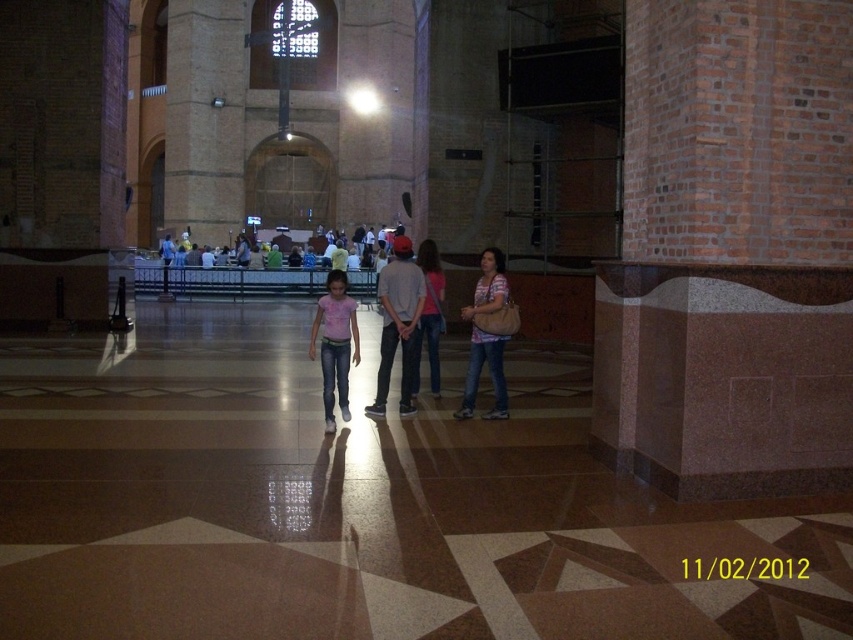
Which is above, gray cotton shirt at center or matte brown purse at center?

gray cotton shirt at center is above.

Which is more to the right, gray cotton shirt at center or matte brown purse at center?

matte brown purse at center

Does point (396, 324) come farther from viewer compared to point (469, 317)?

Yes, it is behind point (469, 317).

At what (x,y) coordinates should I click in order to perform the action: click on gray cotton shirt at center. Please return your answer as a coordinate pair (x, y). The width and height of the screenshot is (853, 640). Looking at the image, I should click on (397, 323).

Can you confirm if matte brown purse at center is shorter than pink denim jeans at center?

Incorrect, matte brown purse at center's height does not fall short of pink denim jeans at center's.

Which is more to the right, matte brown purse at center or pink denim jeans at center?

matte brown purse at center

Which is behind, point (498, 390) or point (343, 285)?

The point (498, 390) is behind.

You are a GUI agent. You are given a task and a screenshot of the screen. Output one action in this format:
    pyautogui.click(x=<x>, y=<y>)
    Task: Click on the matte brown purse at center
    This screenshot has width=853, height=640.
    Given the screenshot: What is the action you would take?
    pyautogui.click(x=480, y=371)

Is point (418, 284) farther from viewer compared to point (418, 262)?

No, (418, 284) is in front of (418, 262).

Who is taller, gray cotton shirt at center or denim jeans at center?

gray cotton shirt at center is taller.

The image size is (853, 640). What do you see at coordinates (397, 323) in the screenshot?
I see `gray cotton shirt at center` at bounding box center [397, 323].

The image size is (853, 640). Find the location of `gray cotton shirt at center`. gray cotton shirt at center is located at coordinates (397, 323).